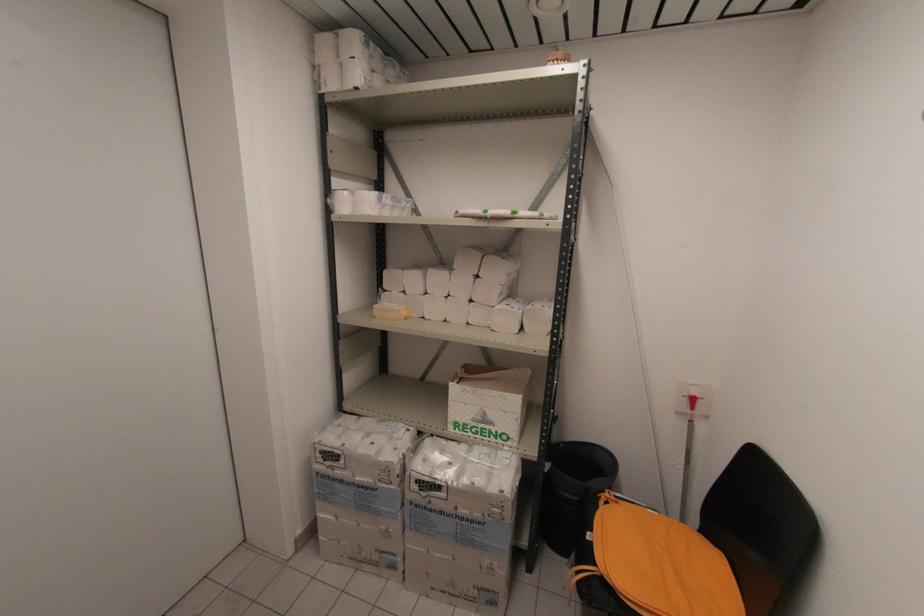
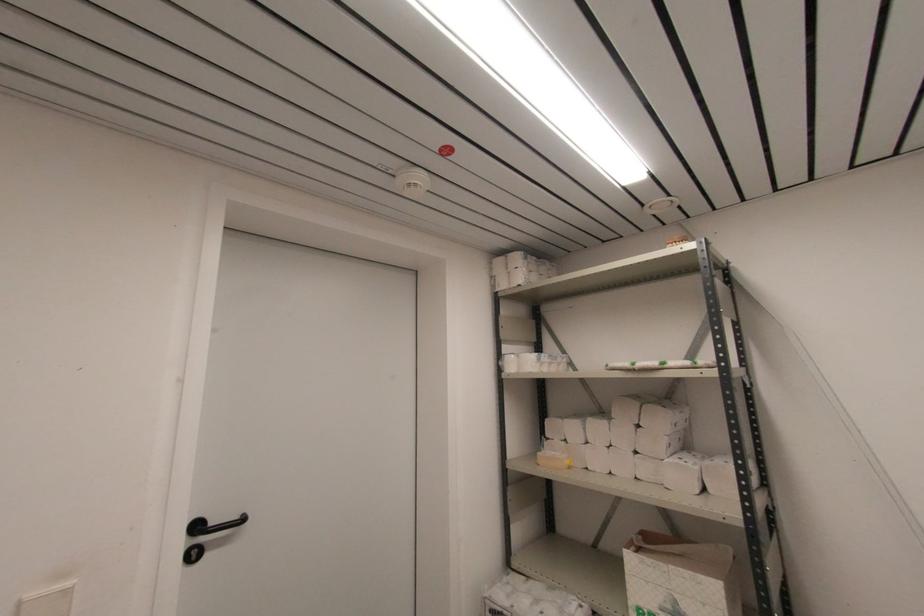
Find the pixel in the second image that matches (375,317) in the first image.

(540, 464)